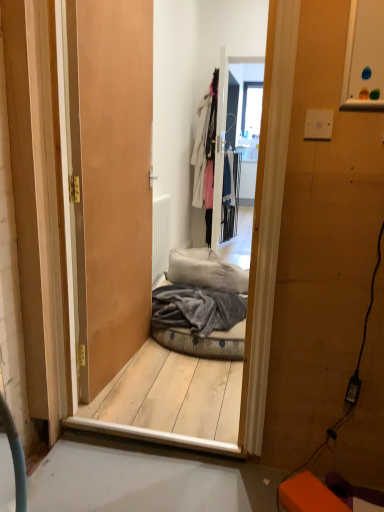
Question: Visually, is white matte radiator at center positioned to the left or to the right of white cotton coat at upper center?

Choices:
 (A) right
 (B) left

Answer: (B)

Question: Based on their sizes in the image, would you say white matte radiator at center is bigger or smaller than white cotton coat at upper center?

Choices:
 (A) big
 (B) small

Answer: (B)

Question: Which is nearer to the white matte radiator at center?

Choices:
 (A) wooden door at center
 (B) velvet grey pet bed at center
 (C) gray fleece blanket at center
 (D) transparent glass window at upper center
 (E) white cotton coat at upper center

Answer: (B)

Question: Which is nearer to the velvet grey pet bed at center?

Choices:
 (A) wooden door at center
 (B) white cotton coat at upper center
 (C) gray fleece blanket at center
 (D) transparent glass window at upper center
 (E) white matte radiator at center

Answer: (C)